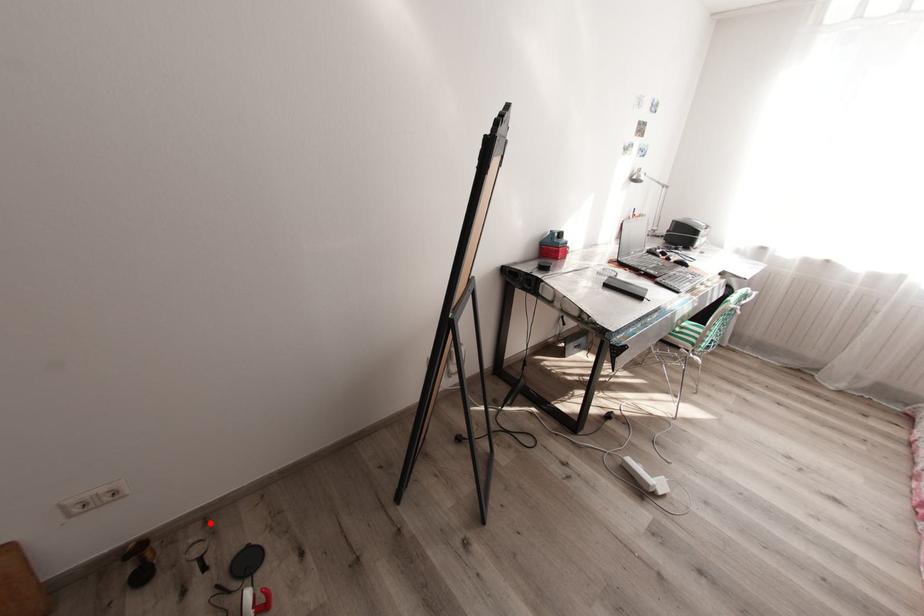
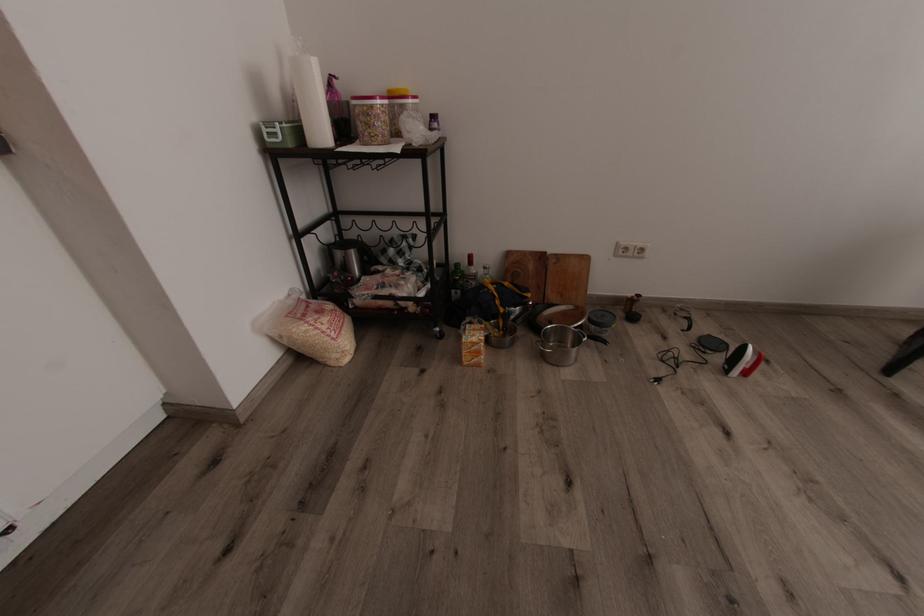
Question: I am providing you with two images of the same scene from different viewpoints. In image1, a red point is highlighted. Considering the same 3D point in image2, which of the following is correct?

Choices:
 (A) It is closer
 (B) It is farther

Answer: (B)